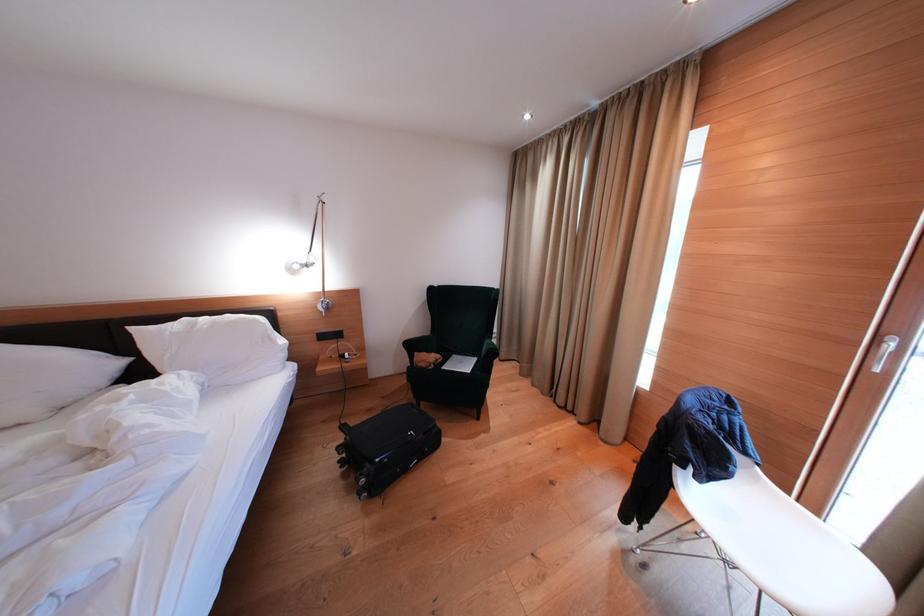
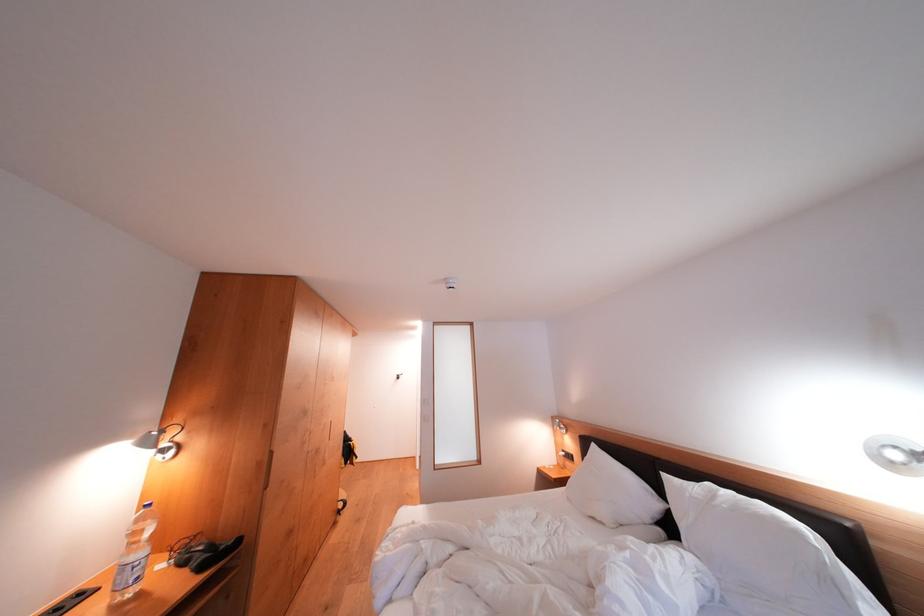
The point at [126,367] is marked in the first image. Where is the corresponding point in the second image?

(664, 509)